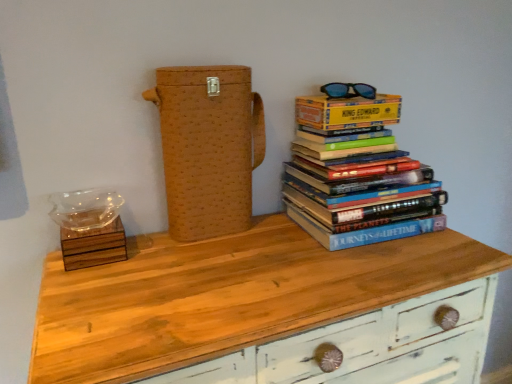
Question: Visually, is yellow paper at upper right positioned to the left or to the right of blue plastic sunglasses at upper right?

Choices:
 (A) left
 (B) right

Answer: (B)

Question: From a real-world perspective, is yellow paper at upper right positioned above or below blue plastic sunglasses at upper right?

Choices:
 (A) below
 (B) above

Answer: (A)

Question: Based on their relative distances, which object is nearer to the hardcover books at upper right?

Choices:
 (A) wooden chest of drawers at center
 (B) brown woven box at center
 (C) blue plastic sunglasses at upper right
 (D) yellow paper at upper right

Answer: (D)

Question: Based on their relative distances, which object is farther from the brown woven box at center?

Choices:
 (A) blue plastic sunglasses at upper right
 (B) yellow paper at upper right
 (C) wooden chest of drawers at center
 (D) hardcover books at upper right

Answer: (A)